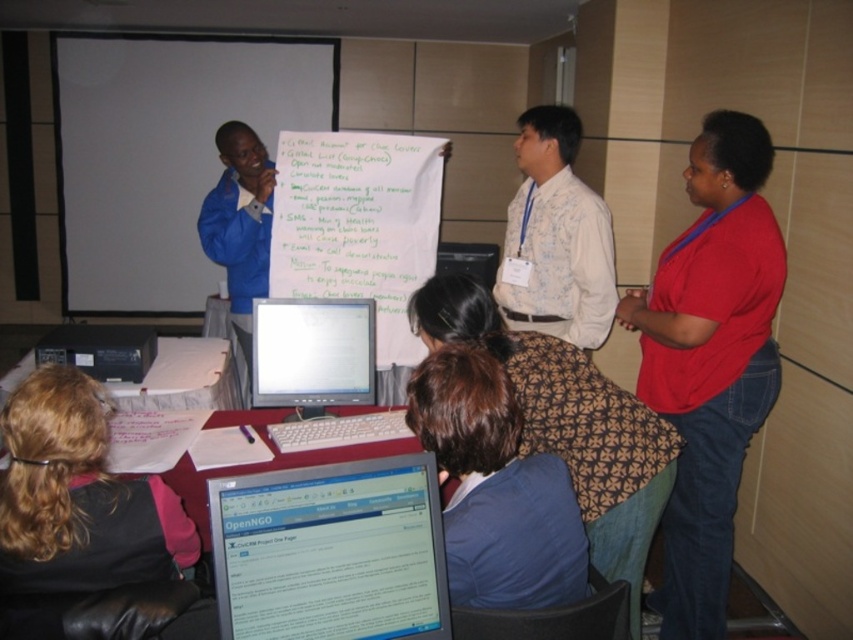
Question: Does brown patterned shirt at lower center appear on the left side of floral shirt at center?

Choices:
 (A) no
 (B) yes

Answer: (B)

Question: Which is farther from the black plastic computer at lower left?

Choices:
 (A) brown patterned shirt at lower center
 (B) floral shirt at center

Answer: (A)

Question: In this image, where is black leather jacket at lower left located relative to blue fabric jacket at upper left?

Choices:
 (A) above
 (B) below

Answer: (B)

Question: Which object is positioned farthest from the brown patterned shirt at lower center?

Choices:
 (A) white paperboard at upper left
 (B) floral shirt at center

Answer: (A)

Question: Which point is farther from the camera taking this photo?

Choices:
 (A) (256, 256)
 (B) (372, 593)

Answer: (A)

Question: Is white paperboard at center to the right of white glossy monitor at center from the viewer's perspective?

Choices:
 (A) no
 (B) yes

Answer: (A)